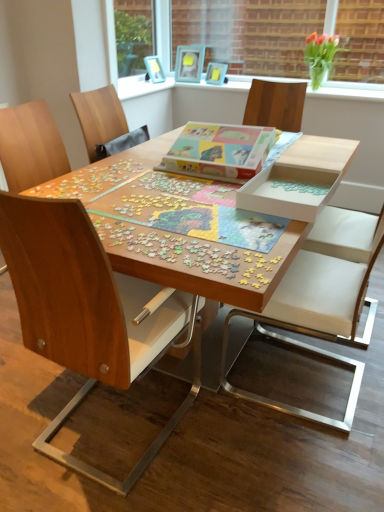
What are the coordinates of `vacant space in green glass vase at upper right (from a real-world perspective)` in the screenshot? It's located at (326, 86).